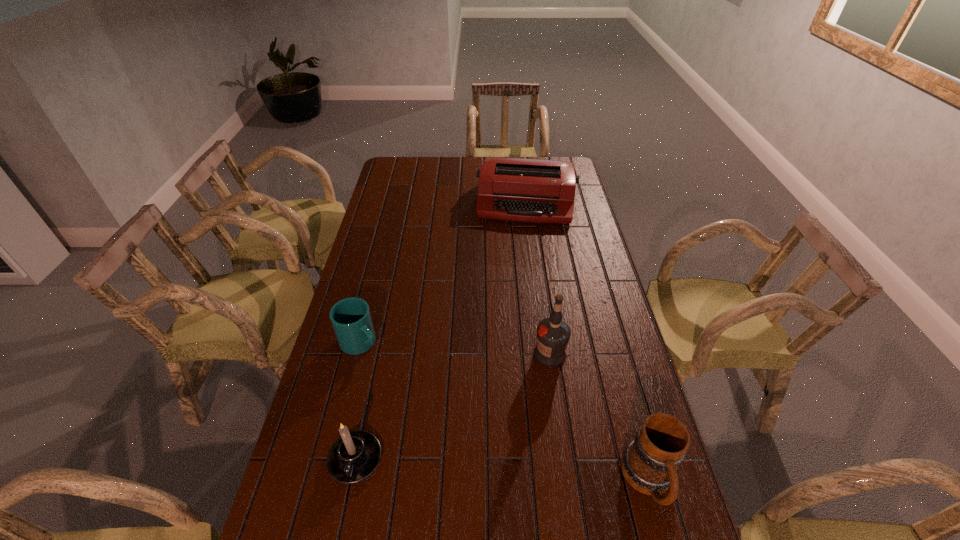
Where is `candle holder`? The image size is (960, 540). candle holder is located at coordinates (354, 456).

This screenshot has width=960, height=540. I want to click on mug, so click(649, 463).

Locate an element on the screen. The height and width of the screenshot is (540, 960). vodka is located at coordinates (553, 334).

The image size is (960, 540). I want to click on cup, so click(x=351, y=319).

You are a GUI agent. You are given a task and a screenshot of the screen. Output one action in this format:
    pyautogui.click(x=<x>, y=<y>)
    Task: Click on the typewriter
    The height and width of the screenshot is (540, 960).
    Given the screenshot: What is the action you would take?
    pyautogui.click(x=526, y=190)

You are a GUI agent. You are given a task and a screenshot of the screen. Output one action in this format:
    pyautogui.click(x=<x>, y=<y>)
    Task: Click on the vacant space located with a handle on the side of the candle holder
    Image resolution: width=960 pixels, height=540 pixels.
    Given the screenshot: What is the action you would take?
    pyautogui.click(x=341, y=528)

Locate an element on the screen. This screenshot has width=960, height=540. free region located on the front label of the tallest object is located at coordinates pyautogui.click(x=512, y=410).

The image size is (960, 540). I want to click on free space located on the front label of the tallest object, so click(522, 394).

You are a GUI agent. You are given a task and a screenshot of the screen. Output one action in this format:
    pyautogui.click(x=<x>, y=<y>)
    Task: Click on the vacant space situated 0.100m on the front label of the tallest object
    This screenshot has height=540, width=960.
    Given the screenshot: What is the action you would take?
    click(526, 389)

The height and width of the screenshot is (540, 960). I want to click on vacant space located on the handle side of the cup, so click(x=427, y=394).